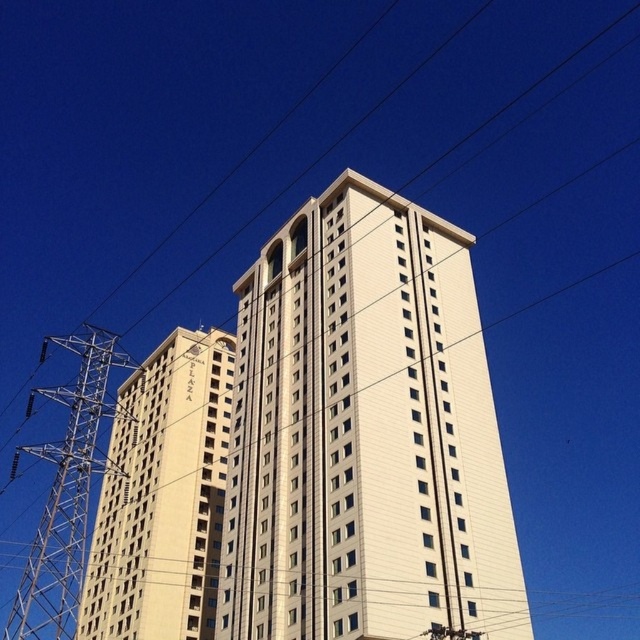
You are standing in front of the beige stone building at left and the metallic silver tower at left. Which one is positioned more to the left side?

The metallic silver tower at left is positioned more to the left than the beige stone building at left.

Consider the image. You are an urban planner analyzing the spatial layout of a city block. You observe the white smooth building at center and the beige stone building at left. Which building occupies more horizontal space in the scene?

The white smooth building at center is wider than the beige stone building at left, so it occupies more horizontal space in the scene.

You are standing at the origin point in this scene. Based on the coordinates given, in which direction relative to you is the white smooth building at center located?

The white smooth building at center is located at coordinates point (x=364, y=435), so it is northeast of the origin point.